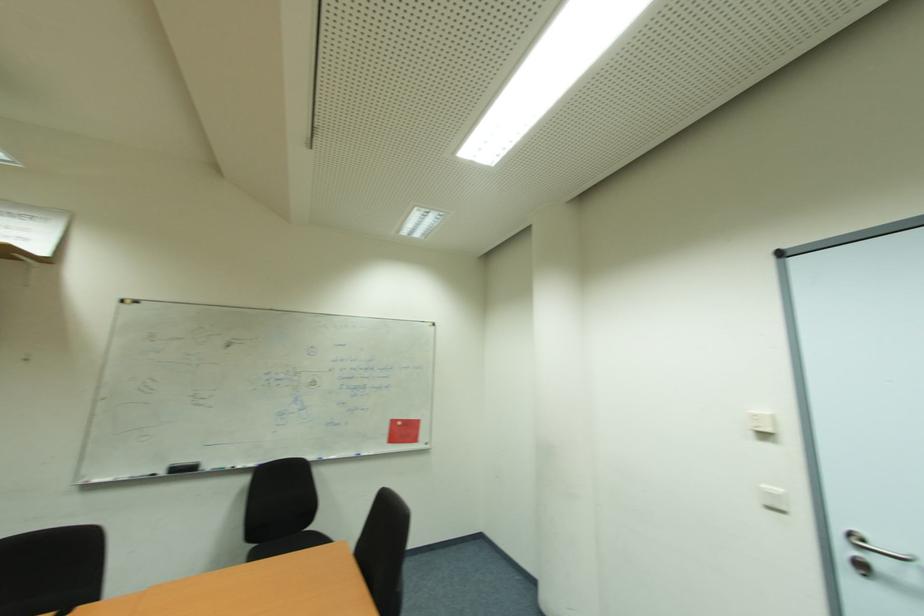
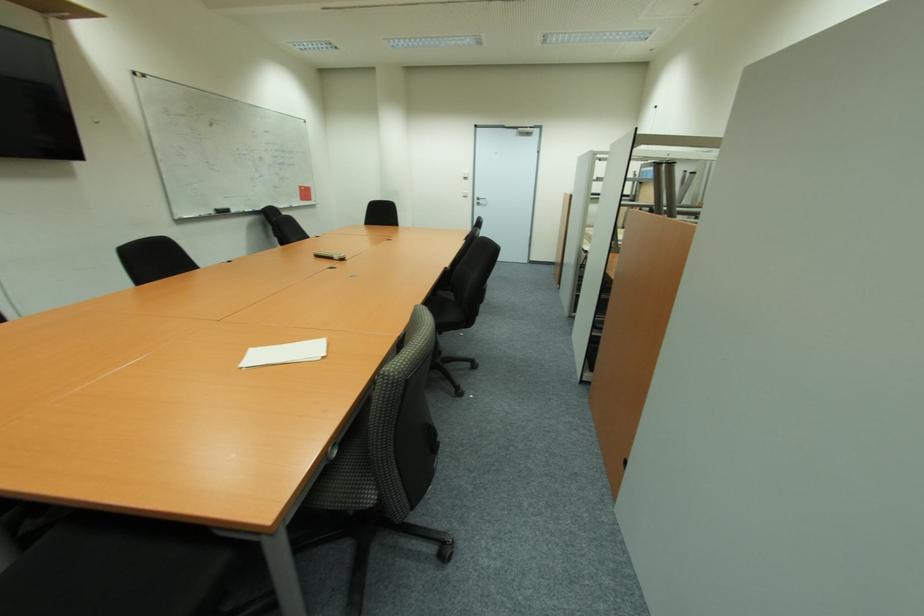
Locate, in the second image, the point that corresponds to pixel 168 471 in the first image.

(215, 214)